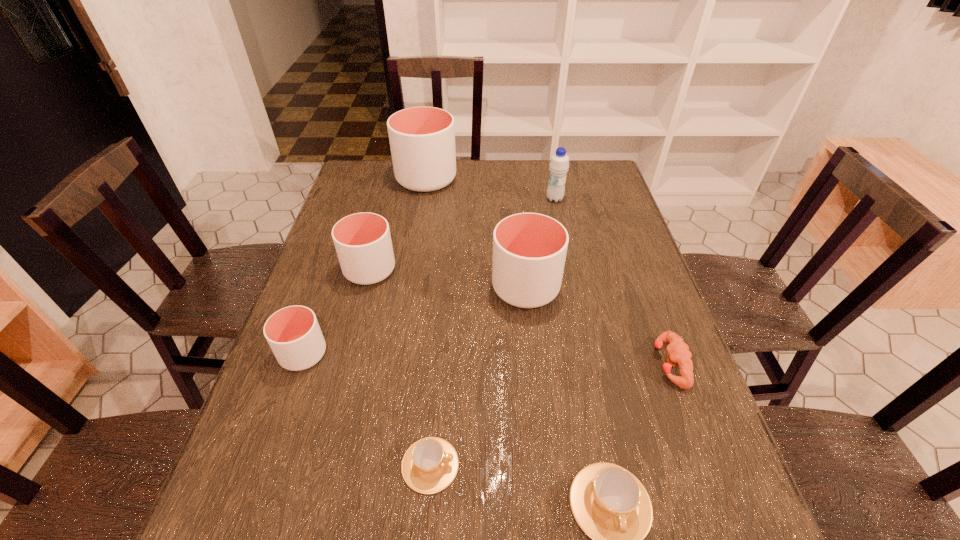
Locate an element on the screen. object that ranks as the fifth closest to the blue water bottle is located at coordinates (293, 333).

Point out which cup is positioned as the third nearest to the fourth tallest cup. Please provide its 2D coordinates. Your answer should be formatted as a tuple, i.e. [(x, y)], where the tuple contains the x and y coordinates of a point satisfying the conditions above.

[(529, 249)]

Select which cup appears as the sixth closest to the blue water bottle. Please provide its 2D coordinates. Your answer should be formatted as a tuple, i.e. [(x, y)], where the tuple contains the x and y coordinates of a point satisfying the conditions above.

[(609, 503)]

Locate which white cup ranks third in proximity to the puncher. Please provide its 2D coordinates. Your answer should be formatted as a tuple, i.e. [(x, y)], where the tuple contains the x and y coordinates of a point satisfying the conditions above.

[(293, 333)]

Locate an element on the screen. The width and height of the screenshot is (960, 540). white cup that stands as the fourth closest to the right brown cup is located at coordinates (422, 139).

Identify the location of blank area in the image that satisfies the following two spatial constraints: 1. on the front side of the rightmost white cup; 2. on the right side of the third tallest cup. (365, 287).